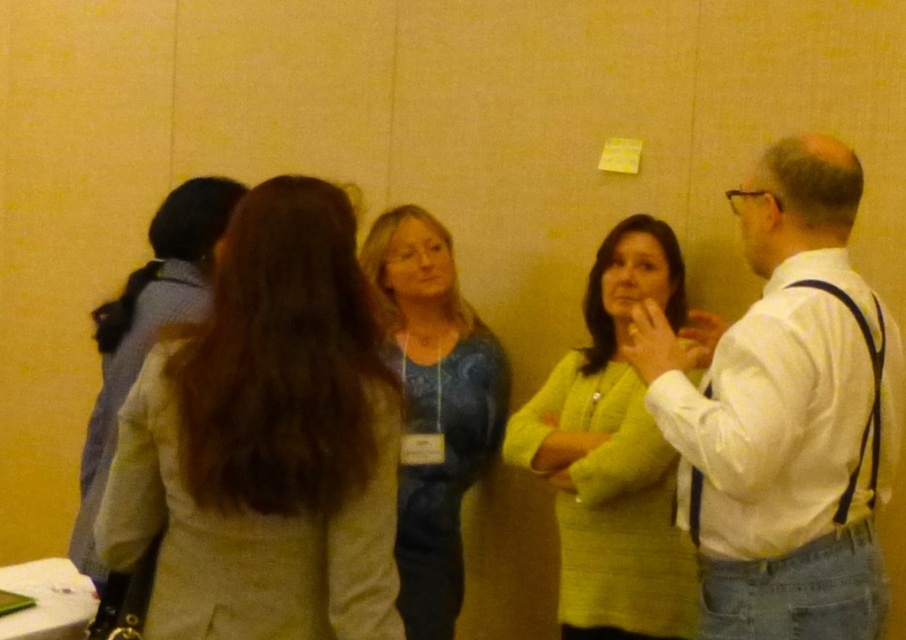
Question: Does light beige fabric coat at center have a lesser width compared to white shirt at center?

Choices:
 (A) no
 (B) yes

Answer: (A)

Question: Which point is closer to the camera?

Choices:
 (A) (887, 458)
 (B) (179, 525)
 (C) (410, 556)

Answer: (B)

Question: Does matte green sweater at center appear under blue textured sweater at center?

Choices:
 (A) no
 (B) yes

Answer: (B)

Question: Which point is farther to the camera?

Choices:
 (A) (137, 540)
 (B) (497, 410)

Answer: (B)

Question: From the image, what is the correct spatial relationship of matte green sweater at center in relation to blue textured sweater at center?

Choices:
 (A) above
 (B) below

Answer: (B)

Question: Which object appears farthest from the camera in this image?

Choices:
 (A) matte green sweater at center
 (B) blue textured sweater at center
 (C) light beige fabric coat at center

Answer: (B)